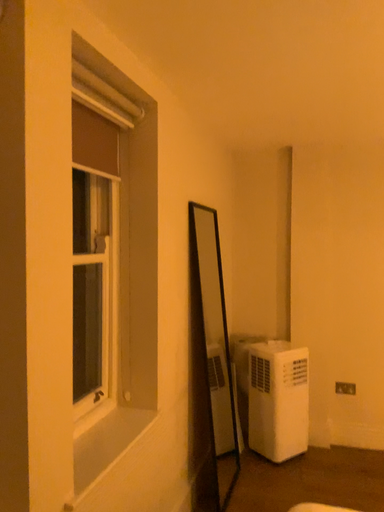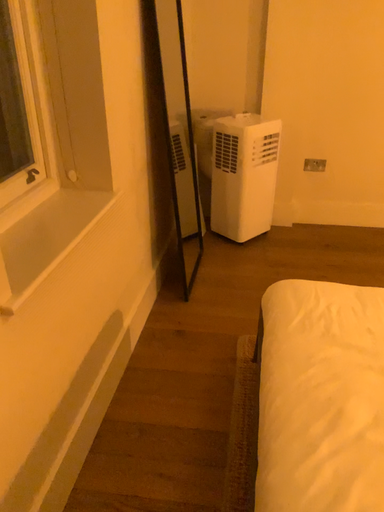
Question: Which way did the camera rotate in the video?

Choices:
 (A) rotated downward
 (B) rotated upward

Answer: (A)